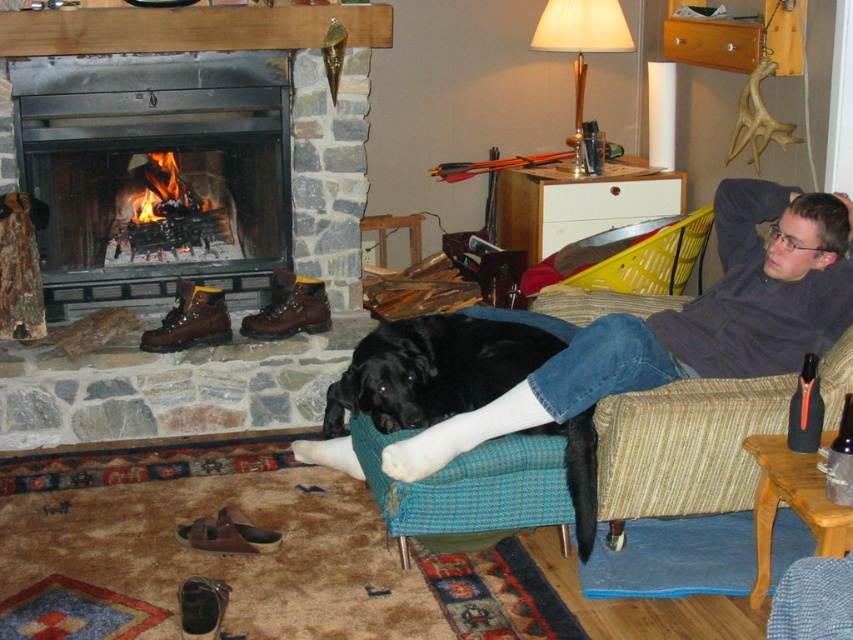
Identify the location of smooth stone fireplace at center. (144, 168).

Does smooth stone fireplace at center appear under black soft fur at lower center?

No.

You are a GUI agent. You are given a task and a screenshot of the screen. Output one action in this format:
    pyautogui.click(x=<x>, y=<y>)
    Task: Click on the smooth stone fireplace at center
    The height and width of the screenshot is (640, 853).
    Given the screenshot: What is the action you would take?
    pyautogui.click(x=144, y=168)

Does black soft fur at lower center have a lesser width compared to black matte bottle at right?

In fact, black soft fur at lower center might be wider than black matte bottle at right.

Who is more forward, (415, 326) or (798, 380)?

Point (798, 380) is more forward.

Measure the distance between point (387,355) and camera.

Point (387,355) and camera are 2.61 meters apart from each other.

You are a GUI agent. You are given a task and a screenshot of the screen. Output one action in this format:
    pyautogui.click(x=<x>, y=<y>)
    Task: Click on the black soft fur at lower center
    The height and width of the screenshot is (640, 853).
    Given the screenshot: What is the action you would take?
    pyautogui.click(x=433, y=369)

Between smooth stone fireplace at center and black matte bottle at right, which one appears on the right side from the viewer's perspective?

From the viewer's perspective, black matte bottle at right appears more on the right side.

Describe the element at coordinates (144, 168) in the screenshot. I see `smooth stone fireplace at center` at that location.

This screenshot has width=853, height=640. Find the location of `smooth stone fireplace at center`. smooth stone fireplace at center is located at coordinates (144, 168).